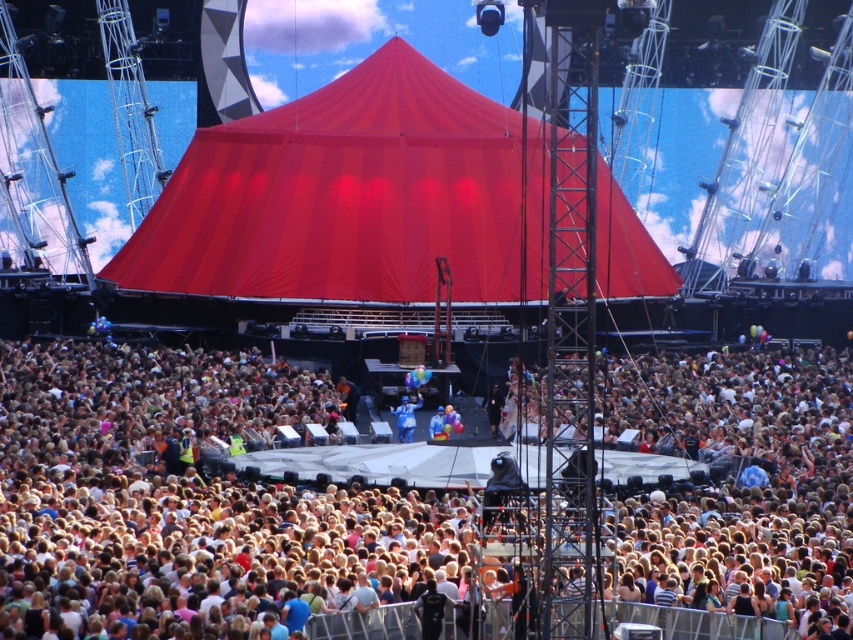
From the picture: Between white cotton crowd at center and blue fabric at center, which one appears on the right side from the viewer's perspective?

Positioned to the right is white cotton crowd at center.

Who is shorter, white cotton crowd at center or blue fabric at center?

blue fabric at center is shorter.

Between point (492, 531) and point (397, 433), which one is positioned in front?

Point (492, 531) is in front.

Where is `white cotton crowd at center`? The width and height of the screenshot is (853, 640). white cotton crowd at center is located at coordinates (219, 502).

Can you confirm if white cotton crowd at center is positioned to the right of red fabric canopy at center?

Yes, white cotton crowd at center is to the right of red fabric canopy at center.

From the picture: Between white cotton crowd at center and red fabric canopy at center, which one appears on the left side from the viewer's perspective?

Positioned to the left is red fabric canopy at center.

The image size is (853, 640). I want to click on white cotton crowd at center, so click(x=219, y=502).

This screenshot has height=640, width=853. I want to click on white cotton crowd at center, so click(219, 502).

Describe the element at coordinates (341, 195) in the screenshot. I see `red fabric canopy at center` at that location.

Between red fabric canopy at center and blue fabric at center, which one has more height?

red fabric canopy at center is taller.

At what (x,y) coordinates should I click in order to perform the action: click on red fabric canopy at center. Please return your answer as a coordinate pair (x, y). Looking at the image, I should click on (341, 195).